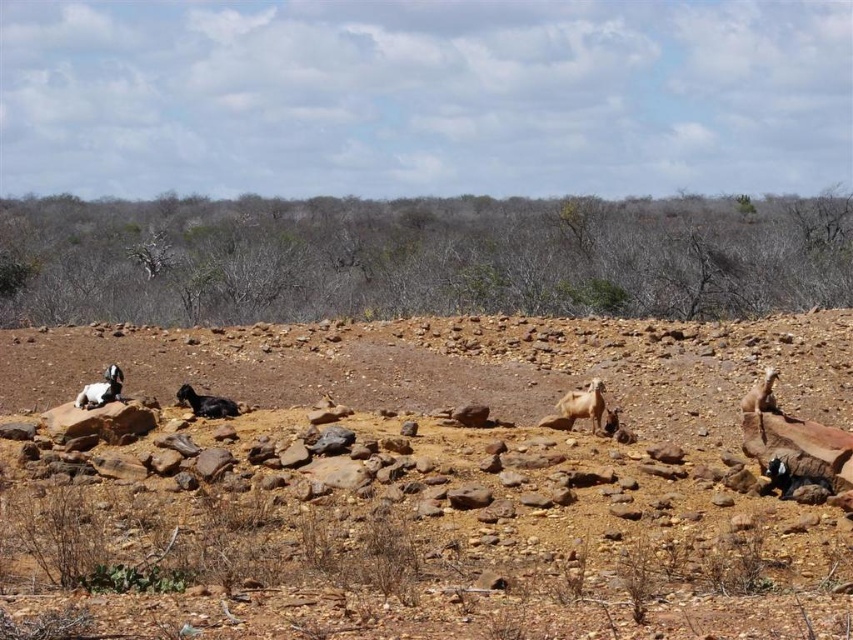
Question: Which of the following is the farthest from the observer?

Choices:
 (A) (202, 301)
 (B) (560, 401)

Answer: (A)

Question: Which of the following is the farthest from the observer?

Choices:
 (A) brown dry shrubs at center
 (B) brown rocky dirt field at center

Answer: (A)

Question: Does brown rocky dirt field at center appear on the right side of white woolen goat at left?

Choices:
 (A) yes
 (B) no

Answer: (A)

Question: From the image, what is the correct spatial relationship of white woolly goat at center in relation to white woolen goat at left?

Choices:
 (A) right
 (B) left

Answer: (A)

Question: Is brown rocky dirt field at center below white woolly goat at center?

Choices:
 (A) yes
 (B) no

Answer: (A)

Question: Considering the real-world distances, which object is farthest from the brown rocky dirt field at center?

Choices:
 (A) brown dry shrubs at center
 (B) white woolen goat at left
 (C) white woolly goat at center

Answer: (A)